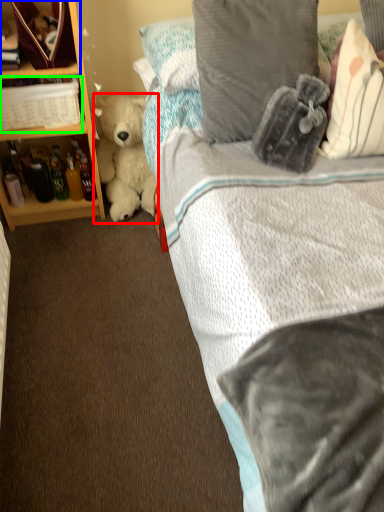
Question: Estimate the real-world distances between objects in this image. Which object is closer to teddy bear (highlighted by a red box), shelf (highlighted by a blue box) or book (highlighted by a green box)?

Choices:
 (A) shelf
 (B) book

Answer: (B)